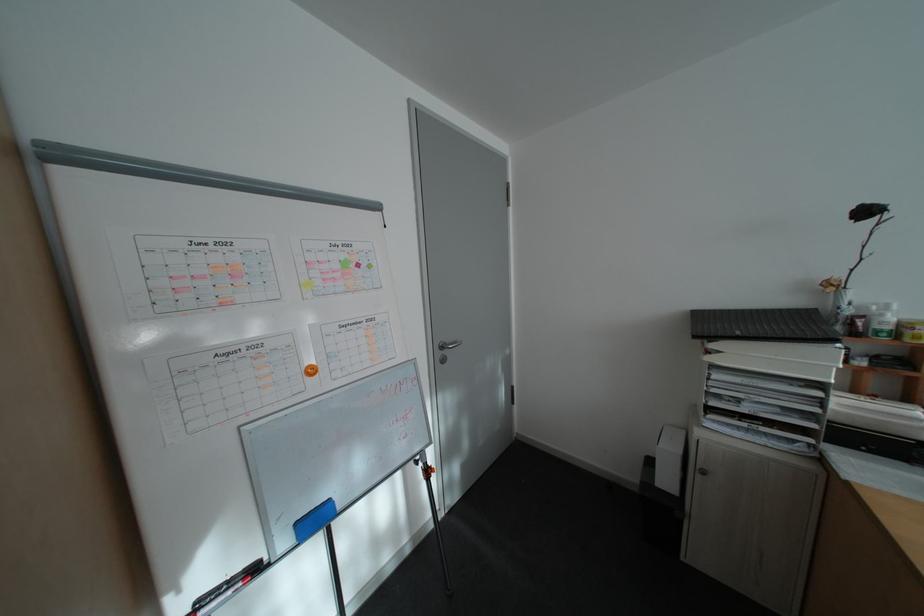
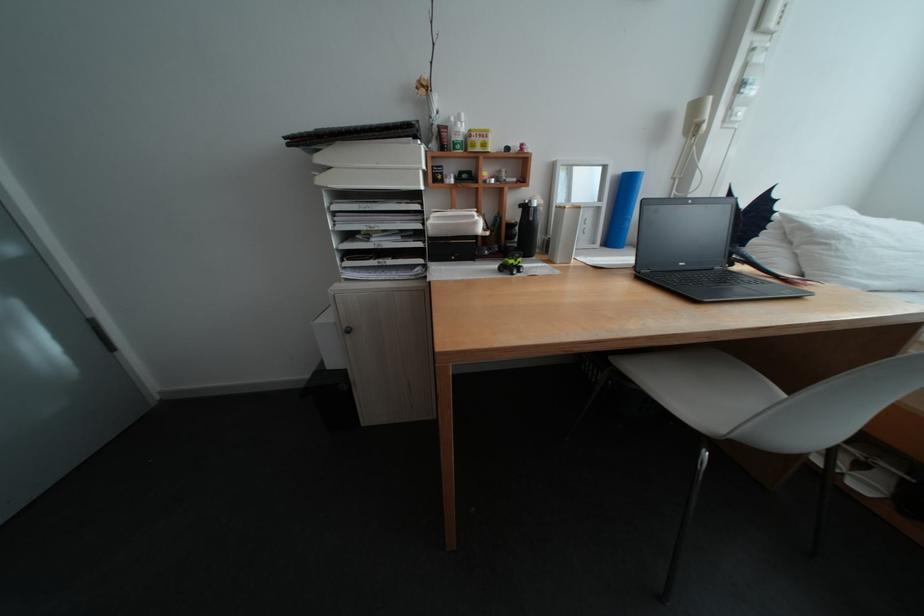
Where in the second image is the point corresponding to (725,346) from the first image?

(333, 160)